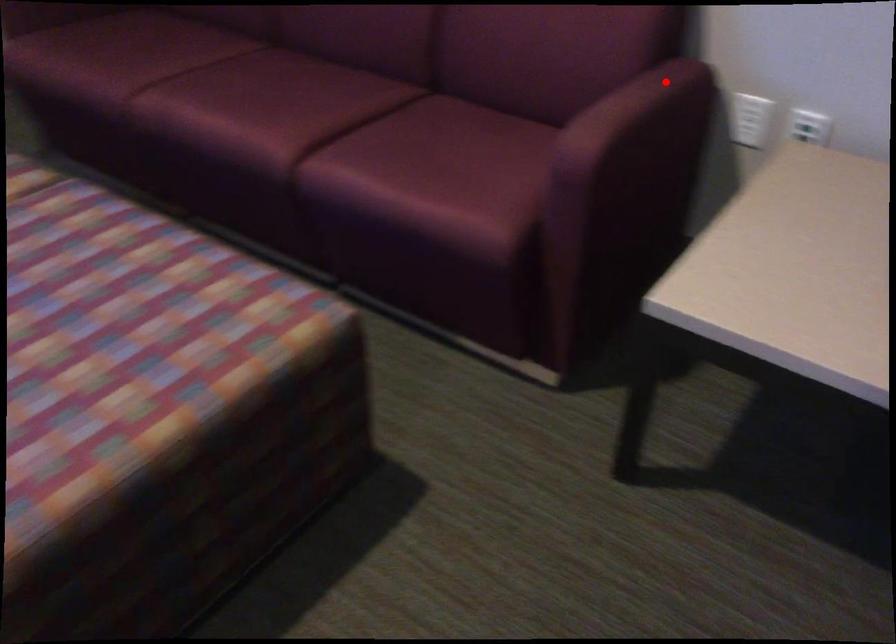
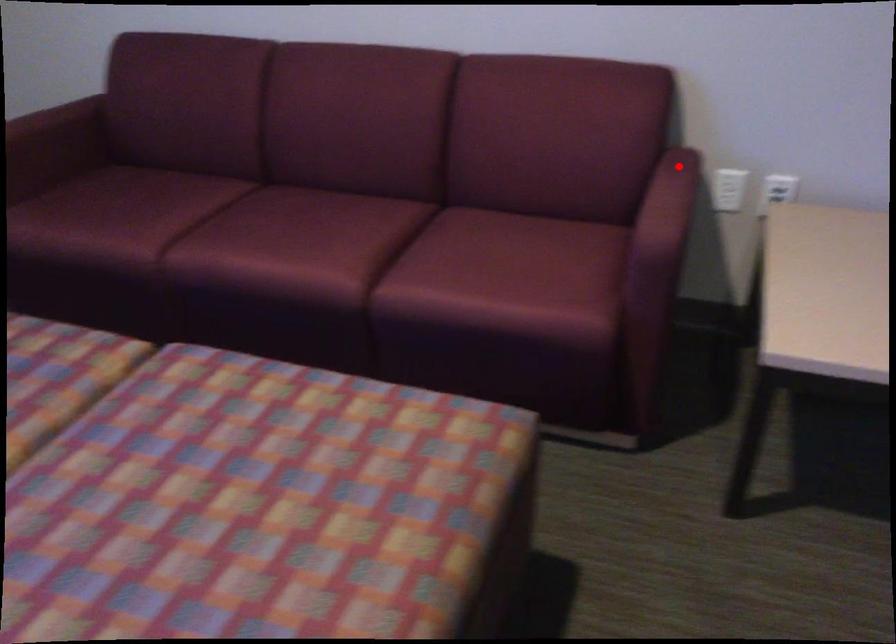
I am providing you with two images of the same scene from different viewpoints. A red point is marked on the first image and another point is marked on the second image. Is the marked point in image1 the same physical position as the marked point in image2?

Yes